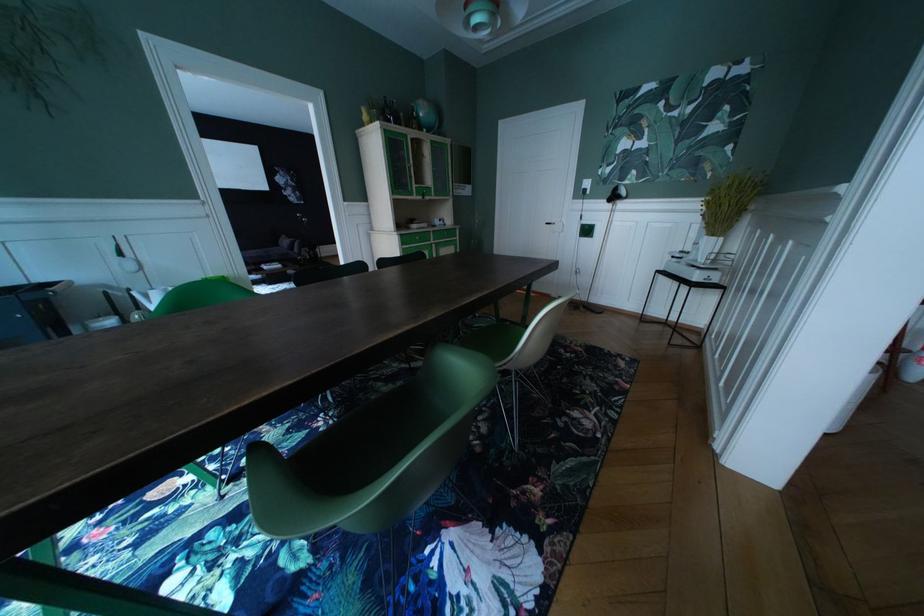
I want to click on black door handle, so click(x=554, y=229).